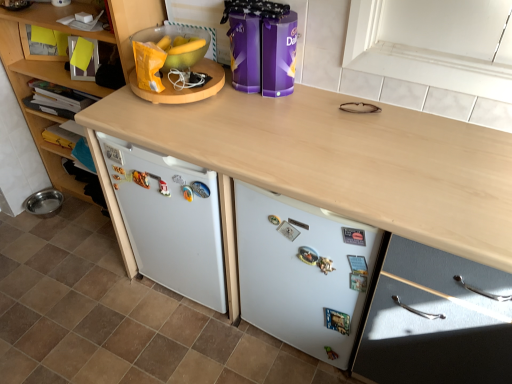
The width and height of the screenshot is (512, 384). What are the coordinates of `free spot in front of purple glossy chocolate tins at center, arranged as the 2th appliance when viewed from the left` in the screenshot? It's located at (240, 113).